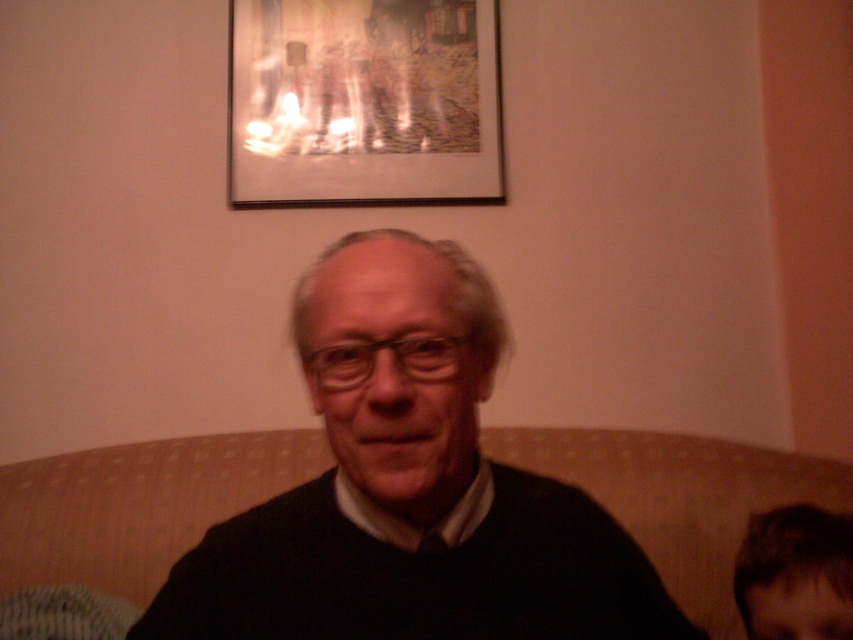
Question: Which object is positioned closest to the dark brown hair at lower right?

Choices:
 (A) beige fabric couch at center
 (B) wooden picture frame at upper center

Answer: (A)

Question: Is black matte sweater at center to the right of dark brown hair at lower right from the viewer's perspective?

Choices:
 (A) no
 (B) yes

Answer: (A)

Question: Based on their relative distances, which object is farther from the black matte sweater at center?

Choices:
 (A) wooden picture frame at upper center
 (B) beige fabric couch at center

Answer: (A)

Question: Is black matte sweater at center below beige fabric couch at center?

Choices:
 (A) no
 (B) yes

Answer: (A)

Question: Can you confirm if black matte sweater at center is smaller than beige fabric couch at center?

Choices:
 (A) yes
 (B) no

Answer: (A)

Question: Among these objects, which one is farthest from the camera?

Choices:
 (A) beige fabric couch at center
 (B) dark brown hair at lower right
 (C) wooden picture frame at upper center

Answer: (C)